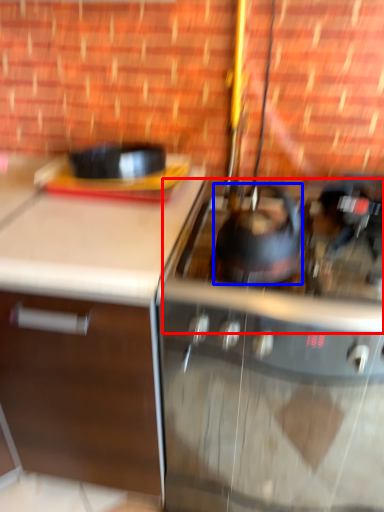
Question: Which of the following is the closest to the observer, gas stove (highlighted by a red box) or kitchen appliance (highlighted by a blue box)?

Choices:
 (A) gas stove
 (B) kitchen appliance

Answer: (A)